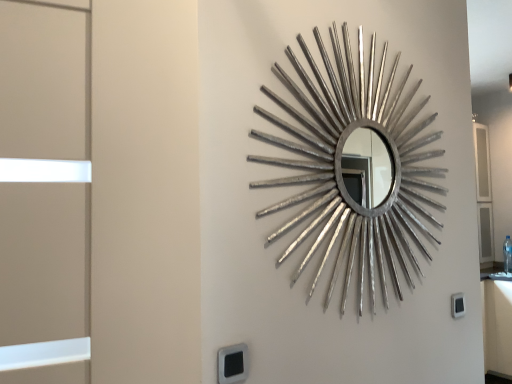
Question: Can you confirm if black plastic electric outlet at lower center, the second electric outlet in the back-to-front sequence, is shorter than silver metallic mirror at center?

Choices:
 (A) yes
 (B) no

Answer: (A)

Question: From the image's perspective, is black plastic electric outlet at lower center, the second electric outlet in the back-to-front sequence, located above silver metallic mirror at center?

Choices:
 (A) yes
 (B) no

Answer: (B)

Question: Is black plastic electric outlet at lower center, which ranks as the 2th electric outlet in right-to-left order, thinner than silver metallic mirror at center?

Choices:
 (A) no
 (B) yes

Answer: (B)

Question: Is silver metallic mirror at center a part of black plastic electric outlet at lower center, the first electric outlet in the front-to-back sequence?

Choices:
 (A) yes
 (B) no

Answer: (B)

Question: Can you confirm if black plastic electric outlet at lower center, which ranks as the 2th electric outlet in right-to-left order, is bigger than silver metallic mirror at center?

Choices:
 (A) yes
 (B) no

Answer: (B)

Question: Is black plastic electric outlet at lower center, the first electric outlet when ordered from left to right, wider than silver metallic mirror at center?

Choices:
 (A) yes
 (B) no

Answer: (B)

Question: Can black plastic electric outlet at lower right, the 1th electric outlet from the back, be found inside silver metallic mirror at center?

Choices:
 (A) no
 (B) yes

Answer: (A)

Question: Is silver metallic mirror at center looking in the opposite direction of black plastic electric outlet at lower right, which appears as the 1th electric outlet when viewed from the right?

Choices:
 (A) yes
 (B) no

Answer: (B)

Question: From a real-world perspective, is silver metallic mirror at center beneath black plastic electric outlet at lower right, which appears as the 1th electric outlet when viewed from the right?

Choices:
 (A) yes
 (B) no

Answer: (B)

Question: Is silver metallic mirror at center bigger than black plastic electric outlet at lower right, arranged as the 2th electric outlet when viewed from the front?

Choices:
 (A) no
 (B) yes

Answer: (B)

Question: Is silver metallic mirror at center thinner than black plastic electric outlet at lower right, arranged as the 2th electric outlet when viewed from the front?

Choices:
 (A) no
 (B) yes

Answer: (A)

Question: Considering the relative sizes of silver metallic mirror at center and black plastic electric outlet at lower right, which appears as the 1th electric outlet when viewed from the right, in the image provided, is silver metallic mirror at center taller than black plastic electric outlet at lower right, which appears as the 1th electric outlet when viewed from the right,?

Choices:
 (A) yes
 (B) no

Answer: (A)

Question: Can you confirm if black plastic electric outlet at lower right, the 1th electric outlet from the back, is positioned to the left of silver metallic mirror at center?

Choices:
 (A) yes
 (B) no

Answer: (B)